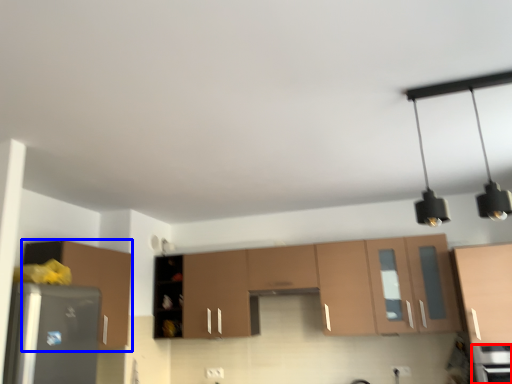
Question: Which point is further to the camera, appliance (highlighted by a red box) or cabinetry (highlighted by a blue box)?

Choices:
 (A) appliance
 (B) cabinetry

Answer: (B)